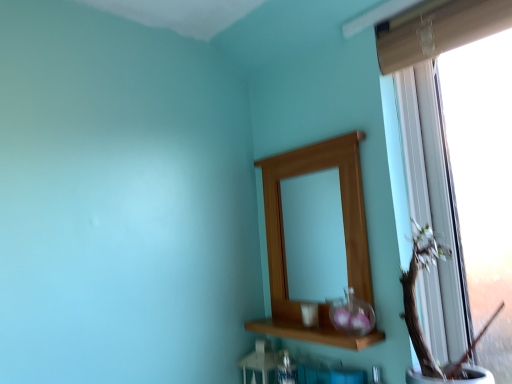
Question: Does point (x=300, y=326) appear closer or farther from the camera than point (x=355, y=311)?

Choices:
 (A) farther
 (B) closer

Answer: (A)

Question: Is wooden shelf at center taller or shorter than transparent glass vase at center?

Choices:
 (A) tall
 (B) short

Answer: (B)

Question: Estimate the real-world distances between objects in this image. Which object is closer to the wooden shelf at center?

Choices:
 (A) transparent glass vase at center
 (B) wooden mirror at upper center
 (C) wooden vase at right

Answer: (A)

Question: Which is nearer to the wooden mirror at upper center?

Choices:
 (A) transparent glass vase at center
 (B) wooden shelf at center
 (C) wooden vase at right

Answer: (B)